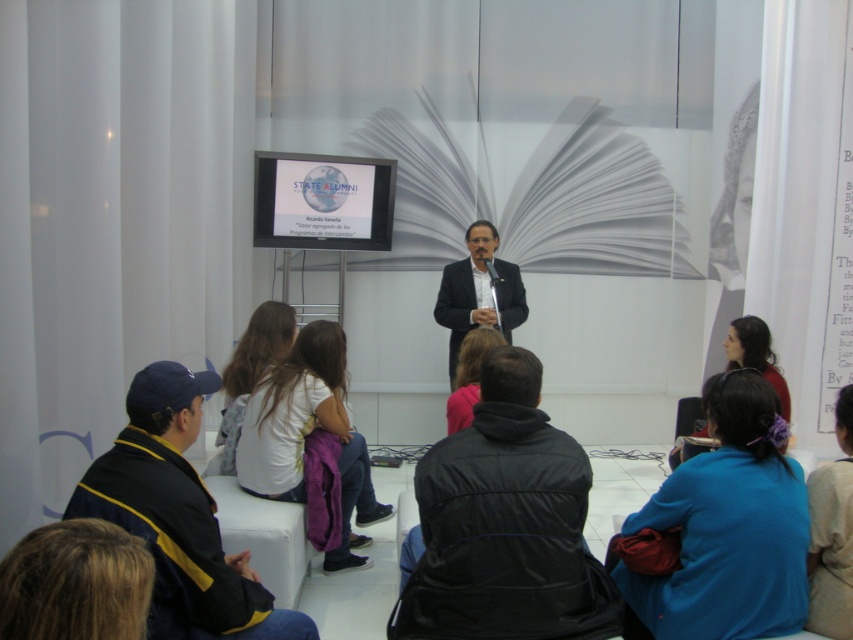
Question: Is blue fabric hair tie at lower right behind graduation gown at lower left?

Choices:
 (A) yes
 (B) no

Answer: (A)

Question: Which point is farther from the camera taking this photo?

Choices:
 (A) tap(851, 524)
 (B) tap(728, 401)
 (C) tap(201, 618)

Answer: (B)

Question: Can you confirm if graduation gown at lower left is bigger than pink fabric at center?

Choices:
 (A) no
 (B) yes

Answer: (B)

Question: Which is farther from the matte black jacket at lower right?

Choices:
 (A) light brown fabric jacket at lower right
 (B) graduation gown at lower left
 (C) pink fabric at center

Answer: (B)

Question: Considering the real-world distances, which object is farthest from the matte black jacket at lower right?

Choices:
 (A) black nylon jacket at center
 (B) graduation gown at lower left
 (C) pink fabric at center

Answer: (B)

Question: Can you confirm if dark suit at center is positioned to the right of pink fabric at center?

Choices:
 (A) yes
 (B) no

Answer: (A)